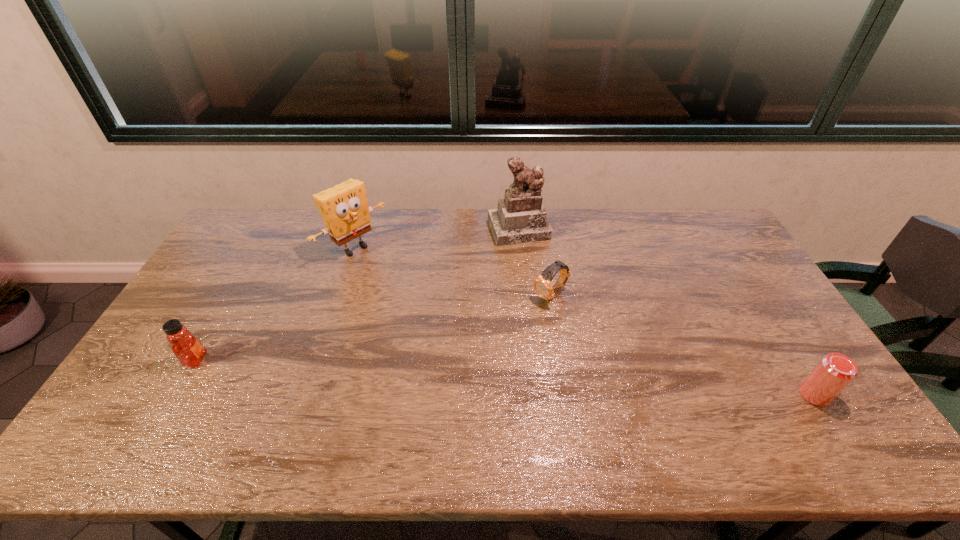
Where is `the leftmost object`? This screenshot has height=540, width=960. the leftmost object is located at coordinates (189, 351).

Identify the location of honey. This screenshot has width=960, height=540. (189, 351).

This screenshot has width=960, height=540. Find the location of `beer can`. beer can is located at coordinates (835, 371).

Where is `the nearest object`? the nearest object is located at coordinates coord(835,371).

Identify the location of the third farthest object. This screenshot has width=960, height=540. (542, 284).

Locate an element on the screen. The width and height of the screenshot is (960, 540). the tallest object is located at coordinates (520, 217).

In order to click on the fourth object from right to left in this screenshot , I will do `click(344, 208)`.

Locate an element on the screen. This screenshot has width=960, height=540. sponge is located at coordinates (344, 208).

Identify the location of vacant point located 0.080m on the front label of the honey. This screenshot has width=960, height=540. (237, 360).

Where is `free space located 0.060m on the left of the nearest object`? This screenshot has width=960, height=540. free space located 0.060m on the left of the nearest object is located at coordinates (777, 395).